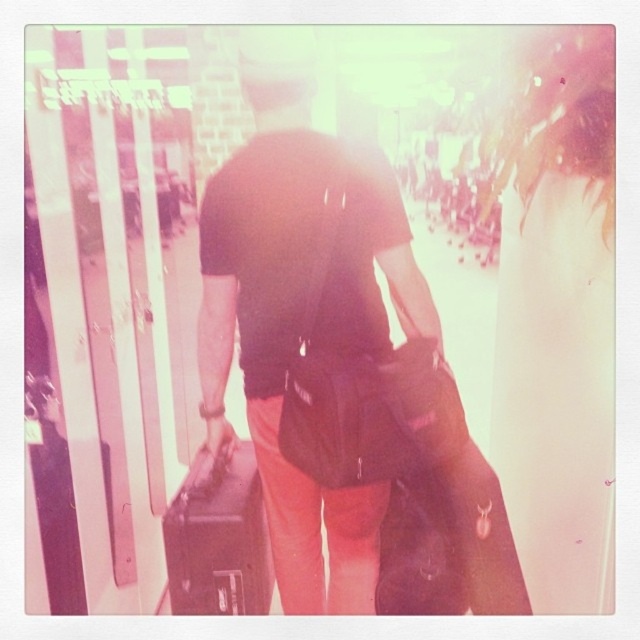
Question: Is matte black suitcase at center behind shiny black suitcase at center?

Choices:
 (A) yes
 (B) no

Answer: (A)

Question: Does matte black suitcase at center lie in front of shiny black suitcase at center?

Choices:
 (A) yes
 (B) no

Answer: (B)

Question: Which point is closer to the camera?

Choices:
 (A) matte black suitcase at center
 (B) shiny black suitcase at center

Answer: (B)

Question: Which point appears farthest from the camera in this image?

Choices:
 (A) (388, 538)
 (B) (282, 209)
 (C) (236, 525)

Answer: (C)

Question: Which of the following is the closest to the observer?

Choices:
 (A) (227, 372)
 (B) (392, 493)
 (C) (196, 566)

Answer: (B)

Question: Does matte black suitcase at center have a smaller size compared to shiny black suitcase at center?

Choices:
 (A) no
 (B) yes

Answer: (A)